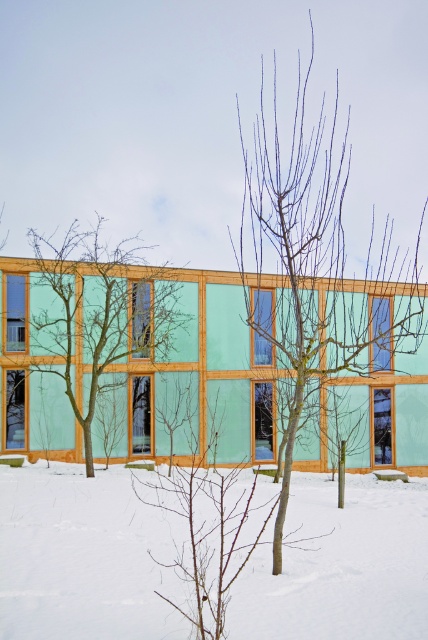
Question: Which object is farther from the camera taking this photo?

Choices:
 (A) white powdery snow at center
 (B) bare branches at center
 (C) green matte tree at left

Answer: (C)

Question: Which point is closer to the camera?

Choices:
 (A) tap(293, 349)
 (B) tap(29, 349)
 (C) tap(39, 547)

Answer: (C)

Question: Can you confirm if white powdery snow at center is bigger than green matte tree at left?

Choices:
 (A) no
 (B) yes

Answer: (A)

Question: In this image, where is white powdery snow at center located relative to green matte tree at left?

Choices:
 (A) below
 (B) above

Answer: (A)

Question: In this image, where is white powdery snow at center located relative to bare branches at center?

Choices:
 (A) left
 (B) right

Answer: (A)

Question: Which point is farther to the camera?

Choices:
 (A) bare branches at center
 (B) white powdery snow at center
 (C) green matte tree at left

Answer: (C)